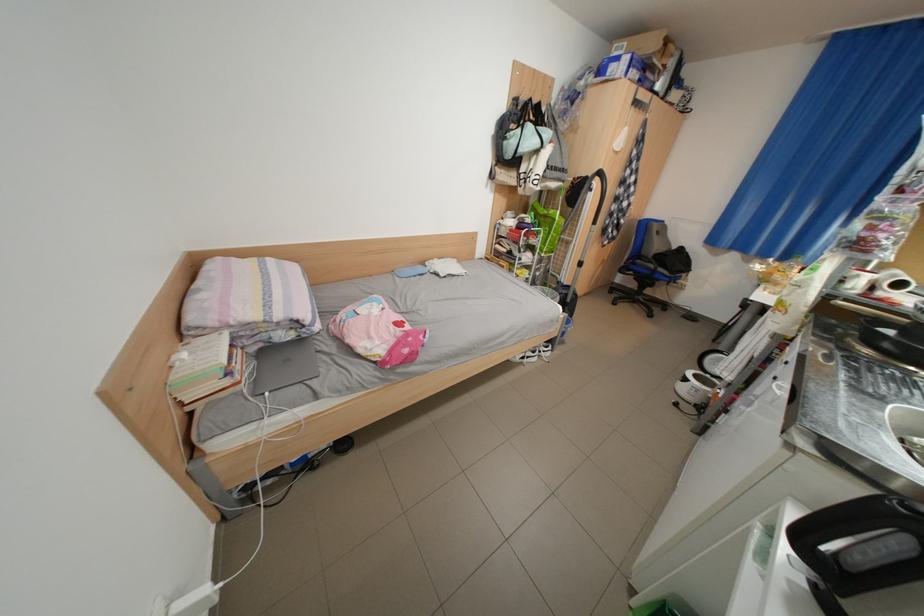
Find where to pull the trolley handle. Please return your answer as a coordinate pair (x, y).

(862, 554)